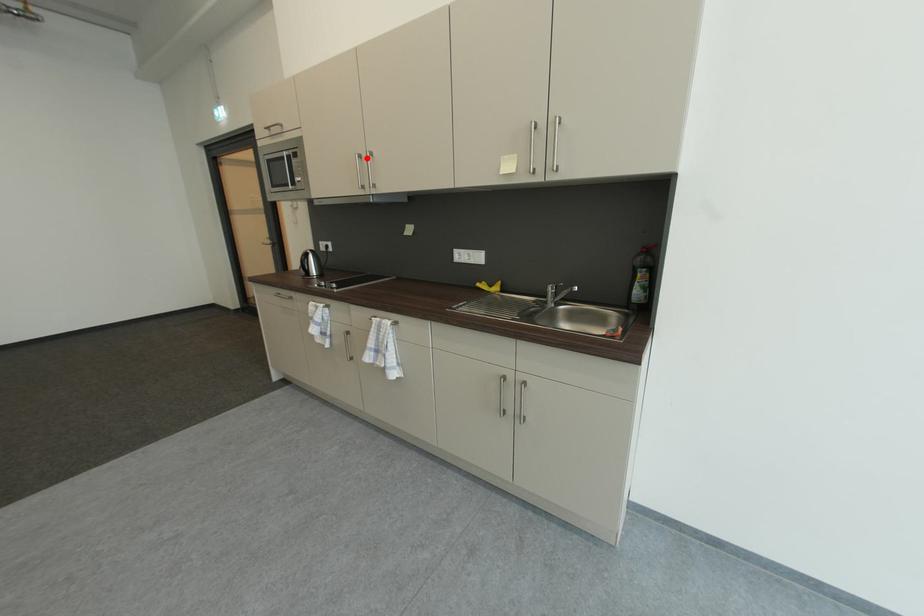
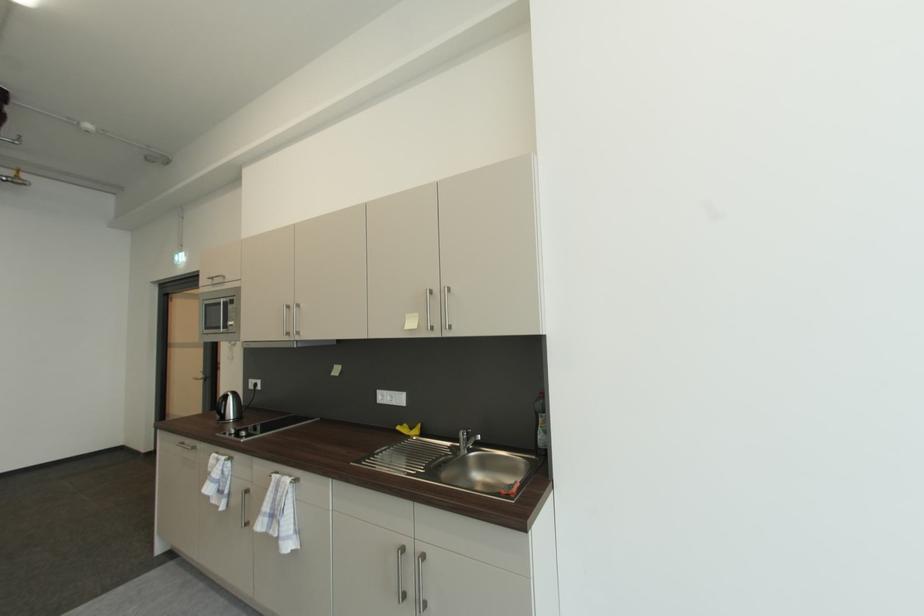
The point at the highlighted location is marked in the first image. Where is the corresponding point in the second image?

(295, 309)